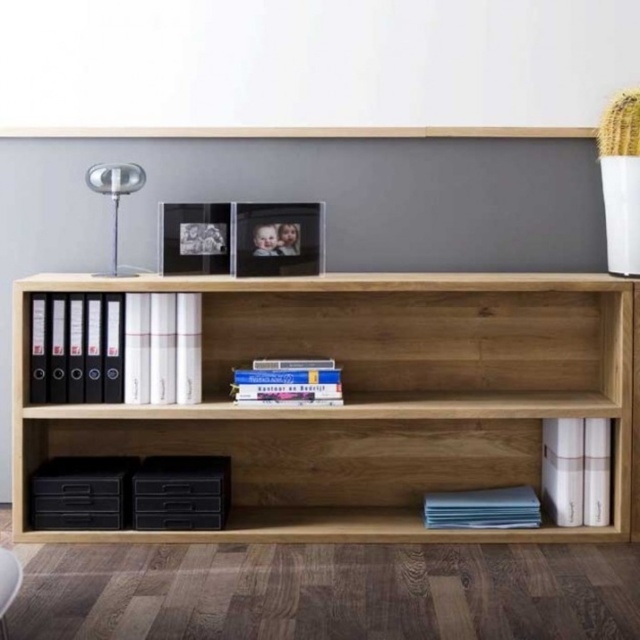
Between natural wood shelf at center and white fabric armchair at lower left, which one has less height?

white fabric armchair at lower left is shorter.

Does natural wood shelf at center have a smaller size compared to white fabric armchair at lower left?

No, natural wood shelf at center is not smaller than white fabric armchair at lower left.

Which is in front, point (321, 292) or point (12, 579)?

Point (12, 579) is in front.

Image resolution: width=640 pixels, height=640 pixels. I want to click on natural wood shelf at center, so click(364, 397).

Is black matte file folder at left to the right of hardcover book at center from the viewer's perspective?

No, black matte file folder at left is not to the right of hardcover book at center.

Does black matte file folder at left have a larger size compared to hardcover book at center?

Yes.

Image resolution: width=640 pixels, height=640 pixels. What do you see at coordinates (120, 348) in the screenshot? I see `black matte file folder at left` at bounding box center [120, 348].

You are a GUI agent. You are given a task and a screenshot of the screen. Output one action in this format:
    pyautogui.click(x=<x>, y=<y>)
    Task: Click on the black matte file folder at left
    
    Given the screenshot: What is the action you would take?
    pyautogui.click(x=120, y=348)

What are the coordinates of `black matte file folder at left` in the screenshot? It's located at (120, 348).

Describe the element at coordinates (120, 348) in the screenshot. I see `black matte file folder at left` at that location.

Identify the location of black matte file folder at left. Image resolution: width=640 pixels, height=640 pixels. (120, 348).